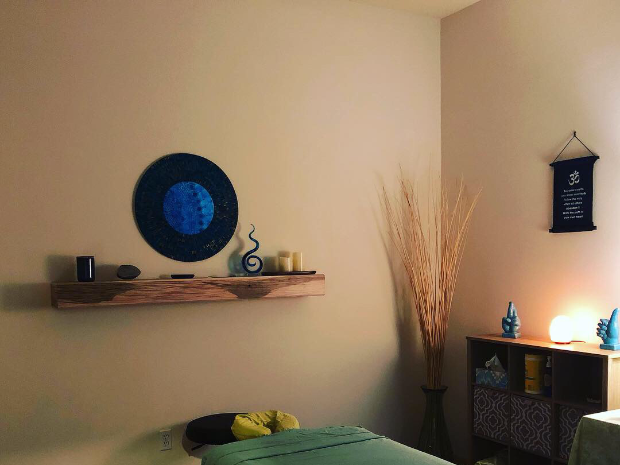
You are a GUI agent. You are given a task and a screenshot of the screen. Output one action in this format:
    pyautogui.click(x=<x>, y=<y>)
    Task: Click on the sculpture
    Image resolution: width=620 pixels, height=465 pixels.
    Given the screenshot: What is the action you would take?
    pyautogui.click(x=249, y=250)